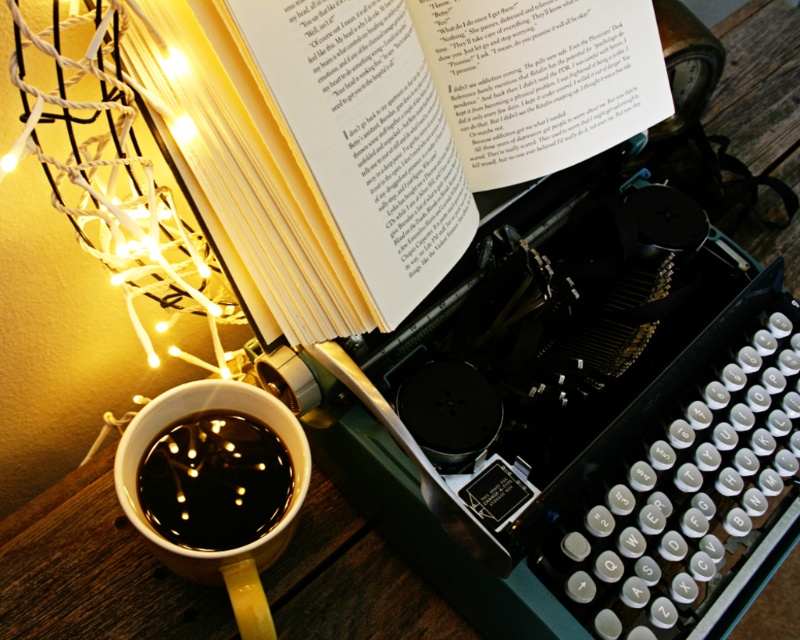
You are standing at the origin point of the coordinate system with the image as the reference. You want to place a new object at the same position as the matte ceramic mug at lower left. What coordinates should you use?

The coordinates for the matte ceramic mug at lower left are at point (216, 486), so you should place the new object at those coordinates.

You are an author who wants to place both the white paper book at upper center and the black glossy mug at lower left on a shelf. The shelf has a height limit of 10 cm. Can both items fit vertically on the shelf?

The white paper book at upper center is taller than the black glossy mug at lower left. However, since the shelf has a height limit of 10 cm, we need to know the exact heights of both items. Unfortunately, the provided information does not specify their actual heights, only their relative size. Therefore, it is impossible to determine if both will fit vertically on the shelf based on the given details.

You are an author who wants to place the matte ceramic mug at lower left on top of the white paper book at upper center. Based on their sizes, will the mug fit without falling off?

The white paper book at upper center is taller than the matte ceramic mug at lower left, so the mug will fit and stay on top of the white paper book at upper center.